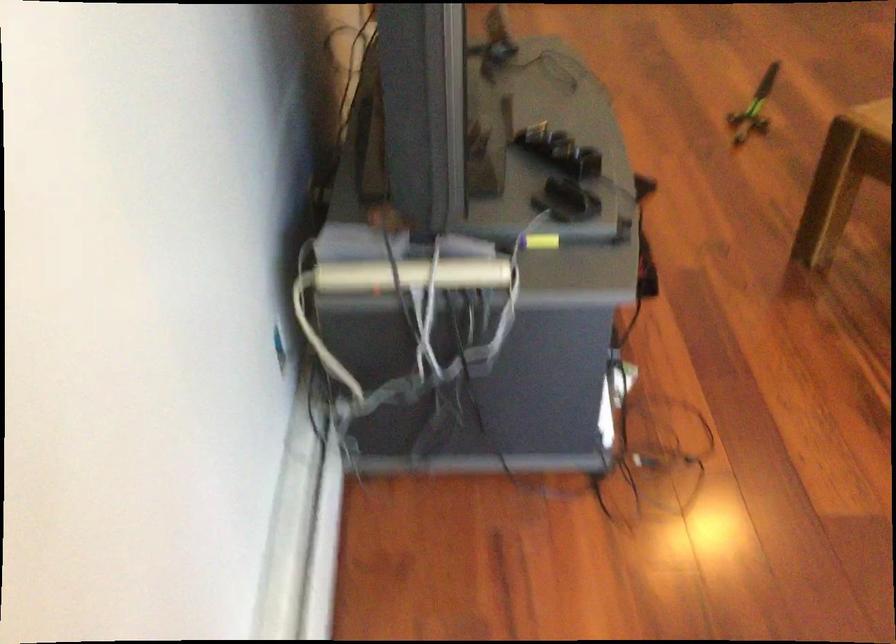
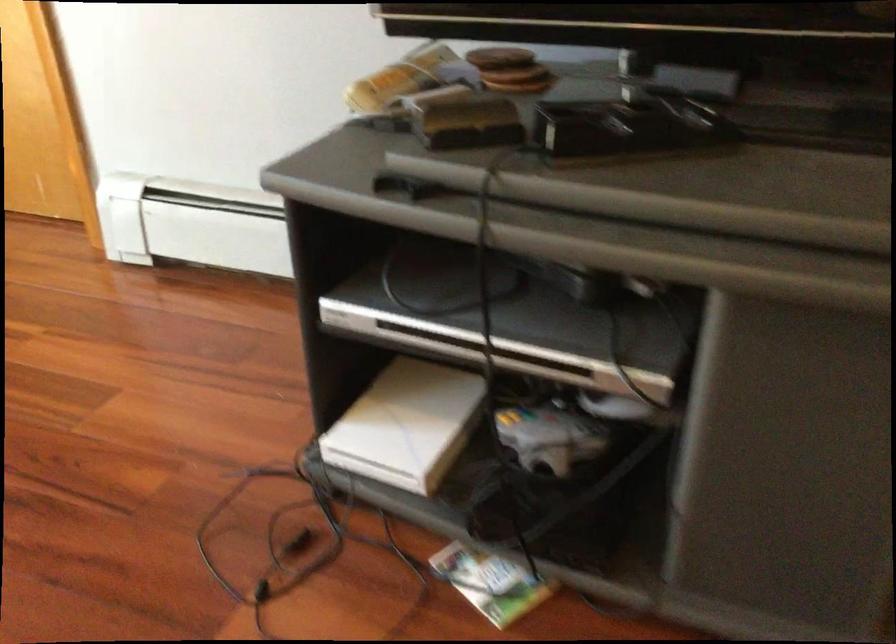
In the second image, find the point that corresponds to [573,194] in the first image.

(469, 124)